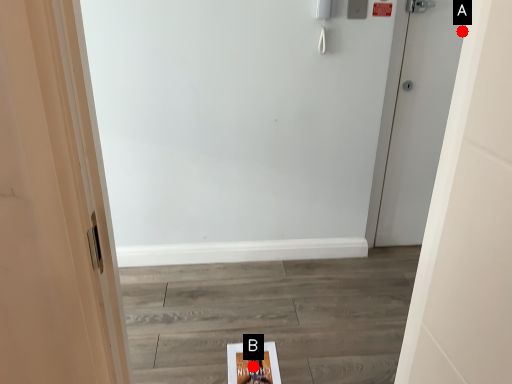
Question: Two points are circled on the image, labeled by A and B beside each circle. Which point is closer to the camera?

Choices:
 (A) A is closer
 (B) B is closer

Answer: (B)